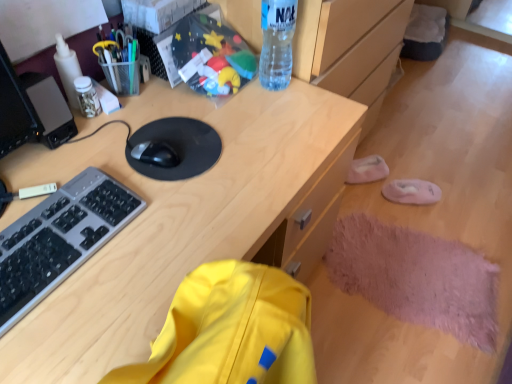
The height and width of the screenshot is (384, 512). What are the coordinates of `free space between gray plastic keyboard at left and translucent plastic jar at upper left, positioned as the 1th stationery in left-to-right order` in the screenshot? It's located at (76, 157).